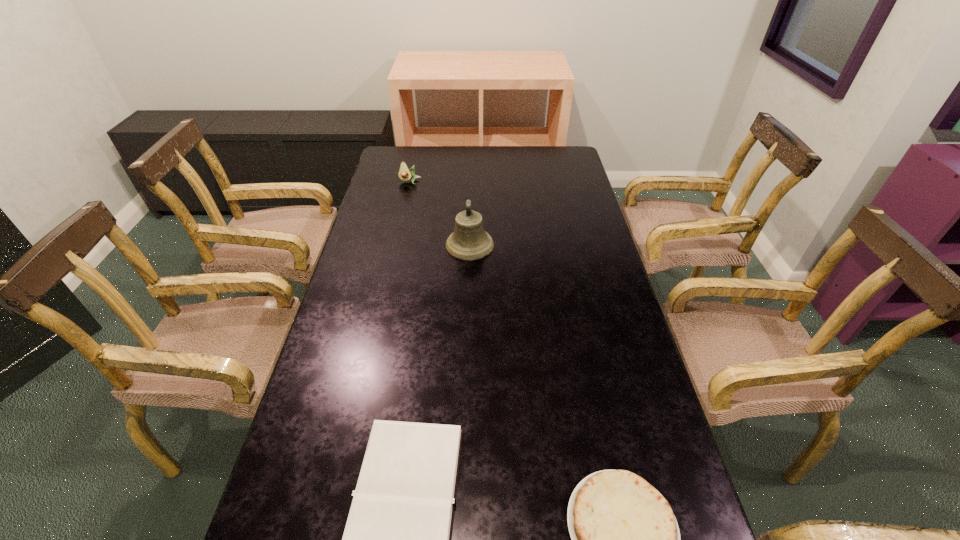
Where is `blank area at the far left corner`? blank area at the far left corner is located at coordinates (388, 147).

What are the coordinates of `vacant space at the far right corner` in the screenshot? It's located at (536, 146).

This screenshot has height=540, width=960. Find the location of `vacant area that lies between the avocado and the bell`. vacant area that lies between the avocado and the bell is located at coordinates (440, 213).

This screenshot has height=540, width=960. I want to click on unoccupied position between the third shortest object and the tallest object, so click(x=440, y=213).

Identify the location of vacant space that's between the avocado and the third nearest object. (440, 213).

Image resolution: width=960 pixels, height=540 pixels. Identify the location of object that is the closest to the tortilla. (397, 539).

I want to click on object that is the third closest to the second farthest object, so click(625, 539).